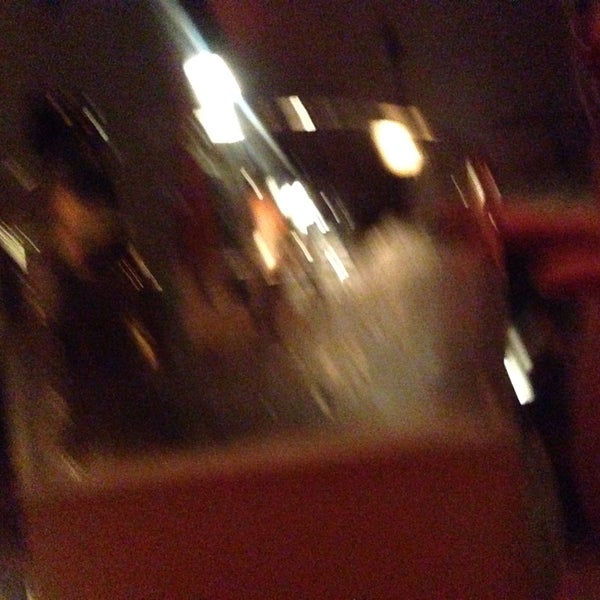
You are a GUI agent. You are given a task and a screenshot of the screen. Output one action in this format:
    pyautogui.click(x=<x>, y=<y>)
    Task: Click on the rectangle shape light
    
    Given the screenshot: What is the action you would take?
    pyautogui.click(x=527, y=394)